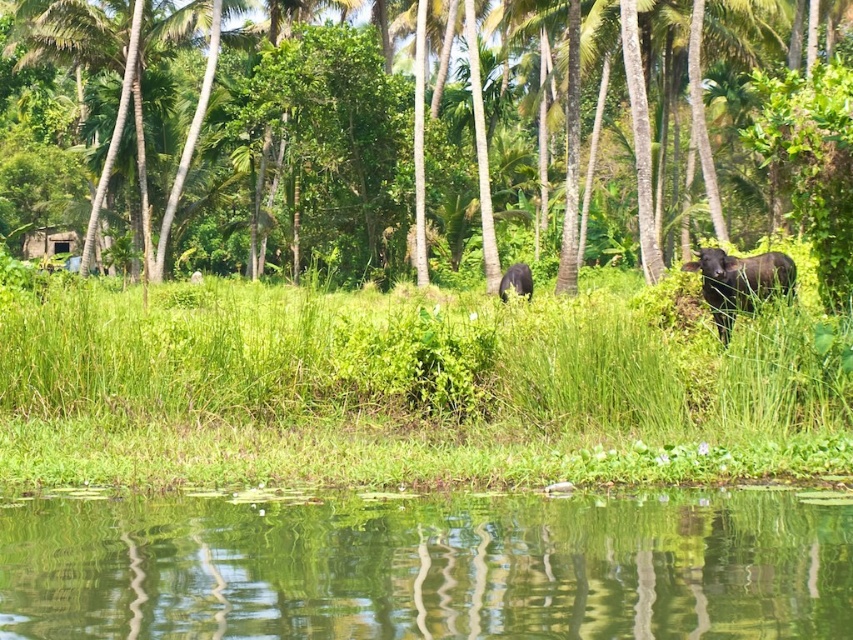
You are a photographer planning to capture the entire scene in one shot. Given that the green leafy tree at center and the green reflective water at lower center are both in view, which object would require more horizontal space in your composition?

The green leafy tree at center requires more horizontal space in the composition because its width surpasses that of the green reflective water at lower center.

Based on the photo, you are a photographer standing at the edge of the green reflective water at lower center. You want to take a picture of the black matte cow at center. Is the cow visible in the water?

The green reflective water at lower center is located below the black matte cow at center, so the cow is standing above the water. Since the water is reflective, the cow would be visible in its reflection.